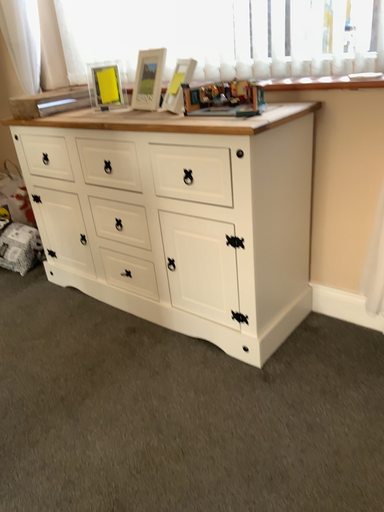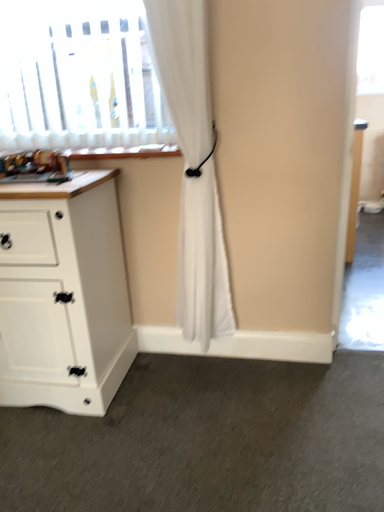
Question: Which way did the camera rotate in the video?

Choices:
 (A) rotated downward
 (B) rotated upward

Answer: (B)